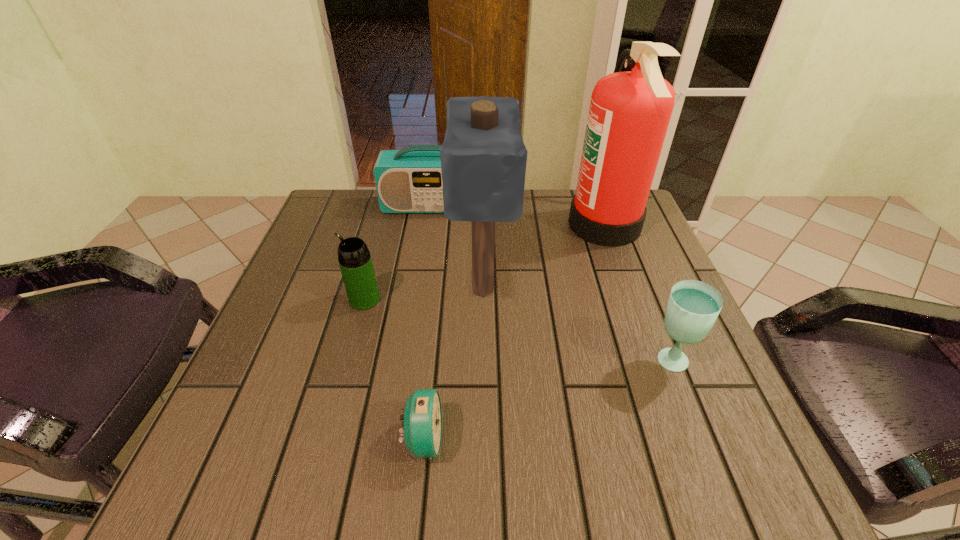
Locate an element on the screen. vacant space that satisfies the following two spatial constraints: 1. at the nozzle of the fifth farthest object; 2. on the right side of the fire extinguisher is located at coordinates pyautogui.click(x=654, y=361).

The image size is (960, 540). I want to click on free space that satisfies the following two spatial constraints: 1. at the nozzle of the fire extinguisher; 2. on the back side of the second nearest object, so click(x=654, y=361).

I want to click on vacant position in the image that satisfies the following two spatial constraints: 1. at the nozzle of the fire extinguisher; 2. on the front side of the mallet, so click(x=628, y=288).